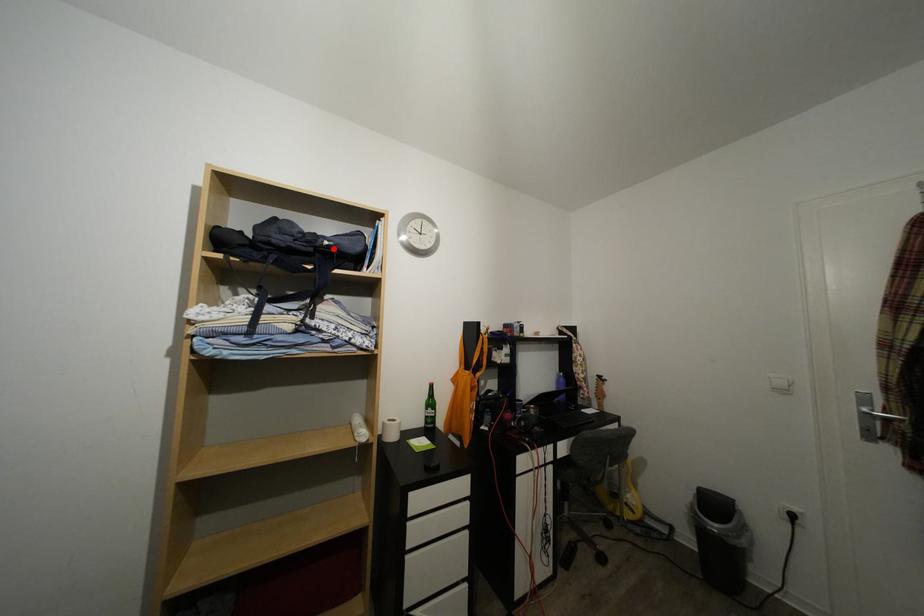
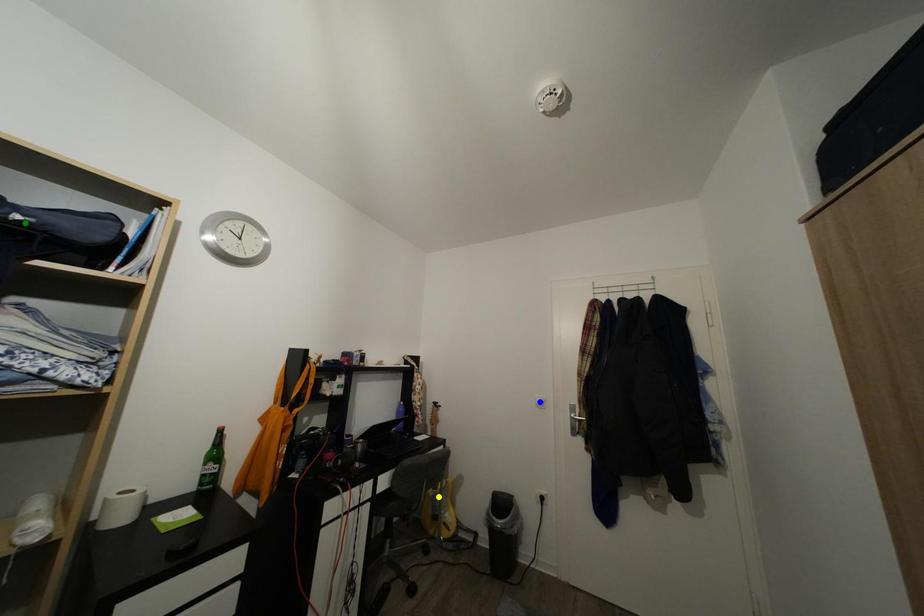
Question: I am providing you with two images of the same scene from different viewpoints. A red point is marked on the first image. You are given multiple points on the second image. In image 2, which mark is for the same physical point as the one in image 1?

Choices:
 (A) green point
 (B) yellow point
 (C) blue point

Answer: (A)